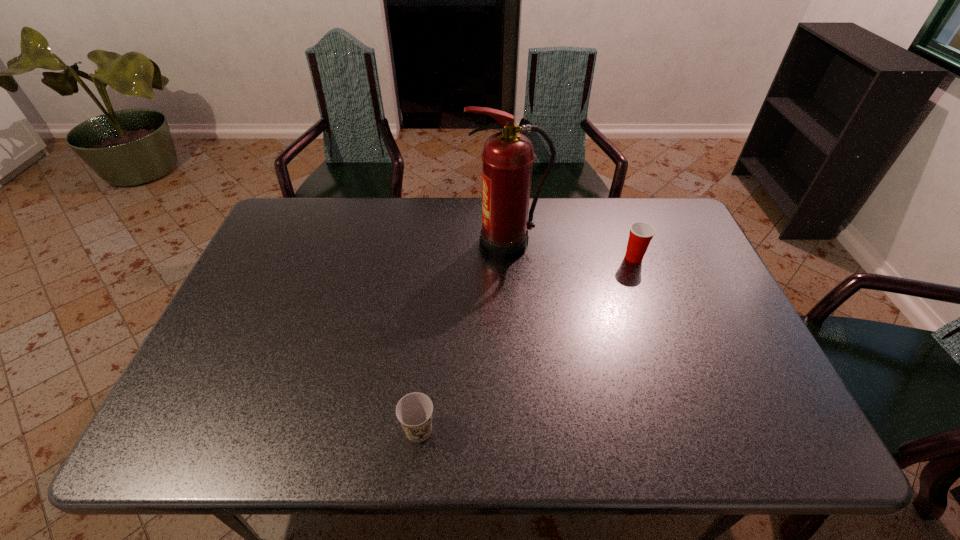
The image size is (960, 540). In order to click on object that is the second closest to the right Dixie cup in this screenshot , I will do `click(414, 411)`.

You are a GUI agent. You are given a task and a screenshot of the screen. Output one action in this format:
    pyautogui.click(x=<x>, y=<y>)
    Task: Click on the object that can be found as the closest to the taller Dixie cup
    
    Given the screenshot: What is the action you would take?
    pyautogui.click(x=507, y=157)

Locate an element on the screen. The width and height of the screenshot is (960, 540). free space that satisfies the following two spatial constraints: 1. on the back side of the right Dixie cup; 2. on the front-facing side of the fire extinguisher is located at coordinates (629, 244).

Where is `free location that satisfies the following two spatial constraints: 1. on the front-facing side of the taller Dixie cup; 2. on the right side of the second object from left to right`? The image size is (960, 540). free location that satisfies the following two spatial constraints: 1. on the front-facing side of the taller Dixie cup; 2. on the right side of the second object from left to right is located at coordinates [508, 258].

Where is `vacant region that satisfies the following two spatial constraints: 1. on the front-facing side of the farther Dixie cup; 2. on the left side of the fire extinguisher`? The width and height of the screenshot is (960, 540). vacant region that satisfies the following two spatial constraints: 1. on the front-facing side of the farther Dixie cup; 2. on the left side of the fire extinguisher is located at coordinates (508, 258).

Locate an element on the screen. vacant space that satisfies the following two spatial constraints: 1. on the front-facing side of the farther Dixie cup; 2. on the right side of the fire extinguisher is located at coordinates (508, 258).

In order to click on vacant region that satisfies the following two spatial constraints: 1. on the front-facing side of the tallest object; 2. on the back side of the right Dixie cup in this screenshot , I will do pos(508,258).

Identify the location of vacant space that satisfies the following two spatial constraints: 1. on the front-facing side of the fire extinguisher; 2. on the right side of the second tallest object. (508, 258).

Find the location of a particular element. vacant region that satisfies the following two spatial constraints: 1. on the front-facing side of the rightmost object; 2. on the left side of the second object from right to left is located at coordinates (508, 258).